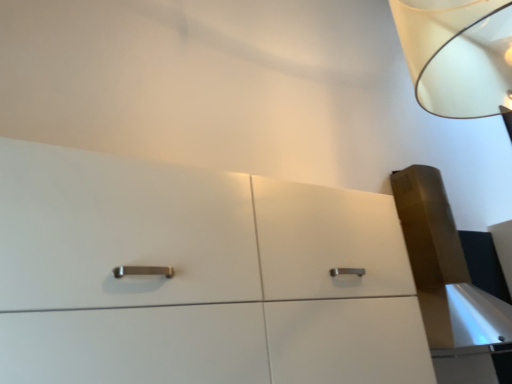
Describe the element at coordinates (197, 276) in the screenshot. I see `white matte cabinet at center` at that location.

What is the approximate width of white matte cabinet at center?

white matte cabinet at center is 16.47 inches in width.

The image size is (512, 384). What are the coordinates of `white matte cabinet at center` in the screenshot? It's located at (197, 276).

Measure the distance between point (160, 341) and camera.

Point (160, 341) and camera are 3.32 feet apart.

The height and width of the screenshot is (384, 512). In order to click on white matte cabinet at center in this screenshot , I will do `click(197, 276)`.